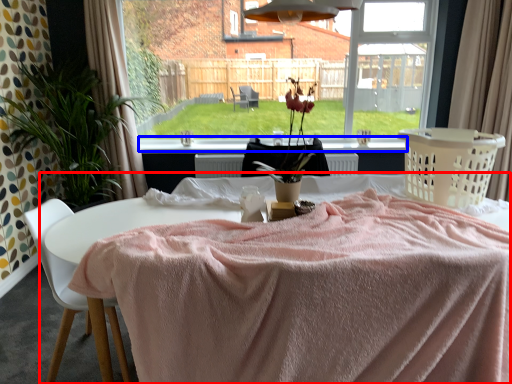
Question: Among these objects, which one is nearest to the camera, table (highlighted by a red box) or window sill (highlighted by a blue box)?

Choices:
 (A) table
 (B) window sill

Answer: (A)